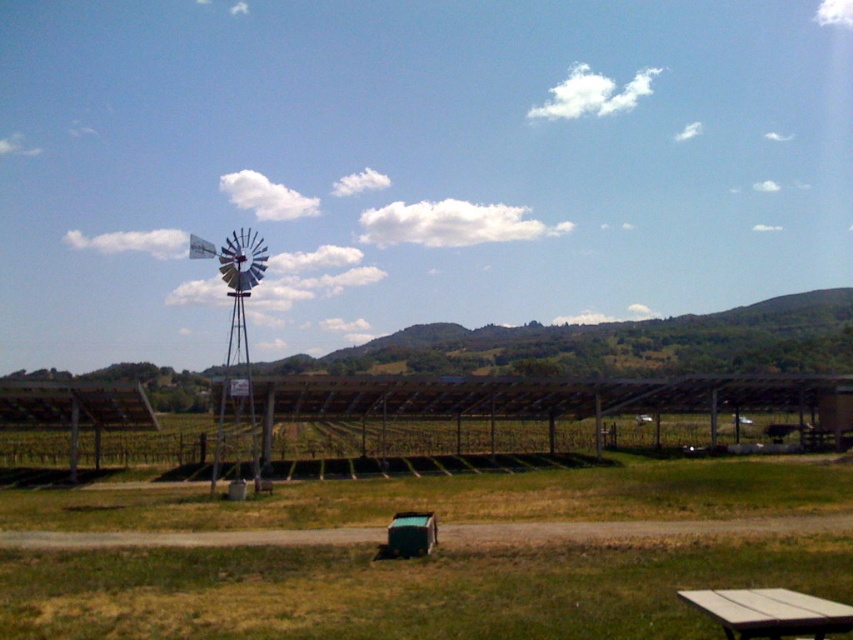
Looking at this image, is white plastic windmill at left smaller than wooden picnic table at lower right?

Actually, white plastic windmill at left might be larger than wooden picnic table at lower right.

Locate an element on the screen. The width and height of the screenshot is (853, 640). white plastic windmill at left is located at coordinates (236, 337).